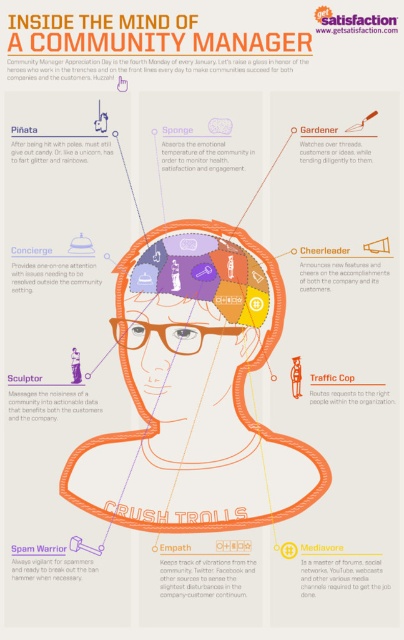
Question: Is matte purple brain at center smaller than orange matte head at center?

Choices:
 (A) yes
 (B) no

Answer: (B)

Question: Among these objects, which one is farthest from the camera?

Choices:
 (A) orange matte head at center
 (B) matte purple brain at center

Answer: (A)

Question: Does matte purple brain at center come behind orange matte head at center?

Choices:
 (A) yes
 (B) no

Answer: (B)

Question: In this image, where is matte purple brain at center located relative to orange matte head at center?

Choices:
 (A) below
 (B) above

Answer: (A)

Question: Which point is farther from the camera taking this photo?

Choices:
 (A) (309, 465)
 (B) (258, 266)

Answer: (B)